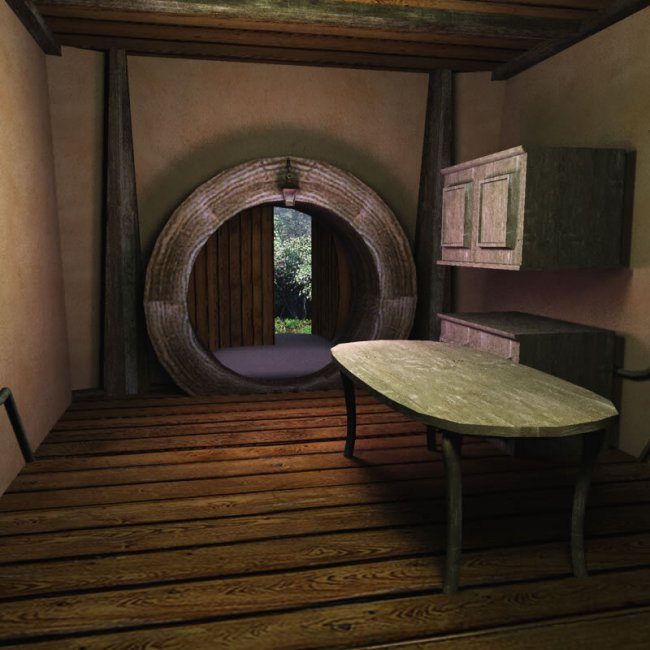
This screenshot has width=650, height=650. Identify the location of door. (302, 287).